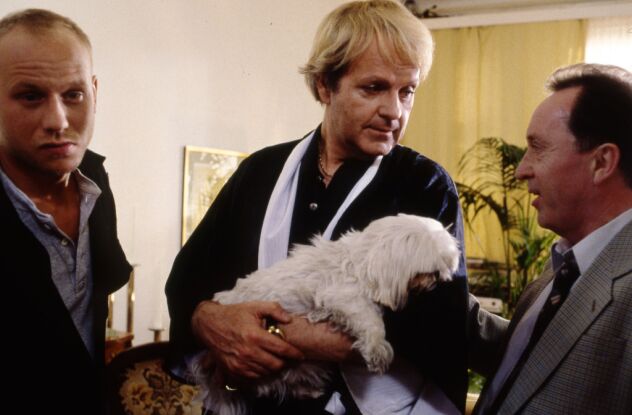
Find the location of a particular element. portrait is located at coordinates (200, 179).